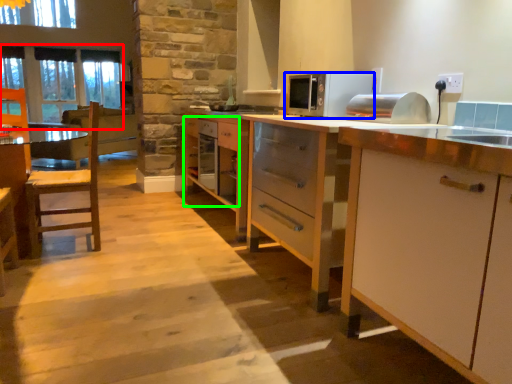
Question: Which object is positioned farthest from window screen (highlighted by a red box)? Select from microwave oven (highlighted by a blue box) and drawer (highlighted by a green box).

Choices:
 (A) microwave oven
 (B) drawer

Answer: (A)